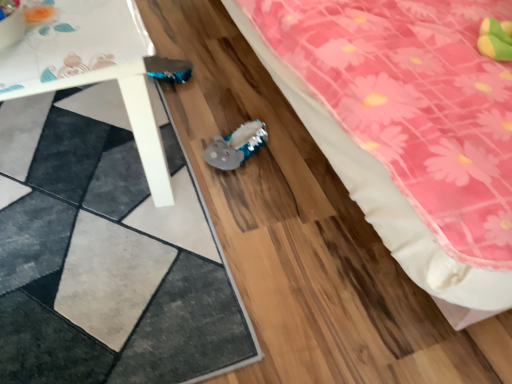
This screenshot has width=512, height=384. I want to click on free area in between fuzzy fabric plushie at center and textured gray rug at lower left, so pos(222,187).